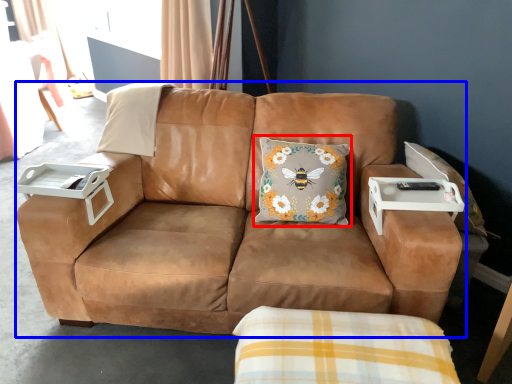
Question: Which point is further to the camera, throw pillow (highlighted by a red box) or studio couch (highlighted by a blue box)?

Choices:
 (A) throw pillow
 (B) studio couch

Answer: (A)